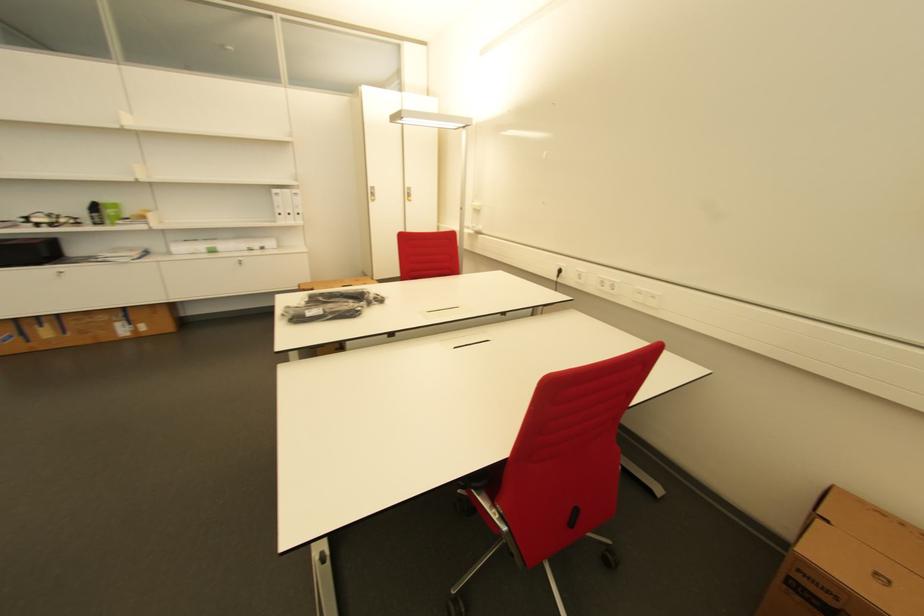
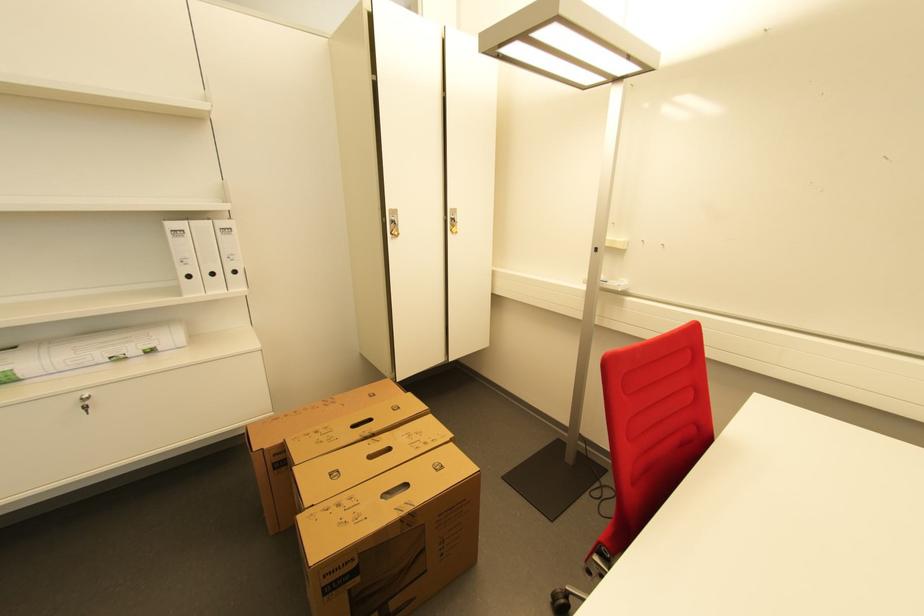
In a continuous first-person perspective shot, in which direction is the camera moving?

The movement direction of the cameraman is left, forward.